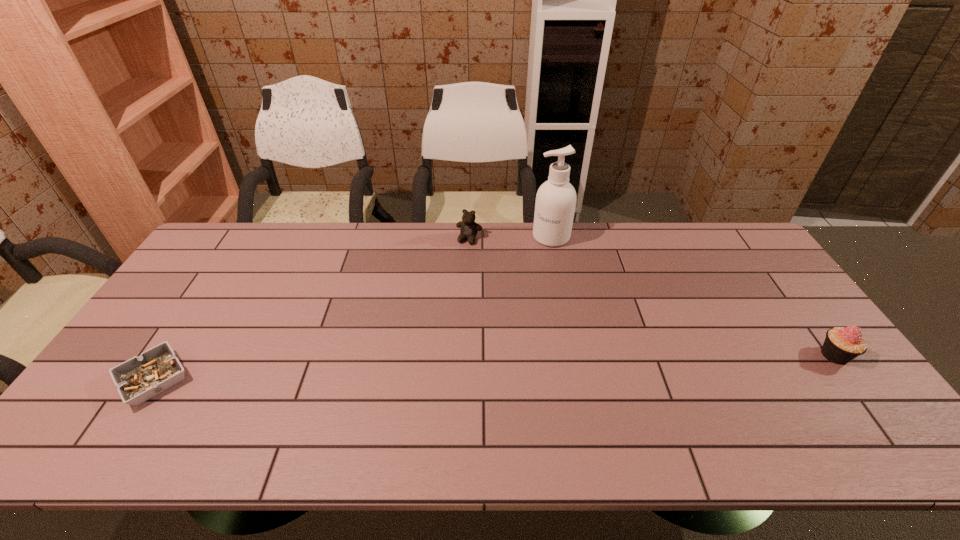
In the image, there is a desktop. Where is `vacant space at the far edge`? The image size is (960, 540). vacant space at the far edge is located at coordinates (635, 256).

Identify the location of vacant space at the near edge of the desktop. (732, 396).

Identify the location of vacant area at the left edge of the desktop. (179, 298).

Find the location of a particular element. The height and width of the screenshot is (540, 960). vacant area at the right edge of the desktop is located at coordinates (747, 272).

Image resolution: width=960 pixels, height=540 pixels. In order to click on free space at the far left corner of the desktop in this screenshot , I will do `click(218, 237)`.

Find the location of a particular element. This screenshot has width=960, height=540. free space between the third object from right to left and the second object from right to left is located at coordinates (510, 238).

You are a GUI agent. You are given a task and a screenshot of the screen. Output one action in this format:
    pyautogui.click(x=<x>, y=<y>)
    Task: Click on the vacant area that lies between the cupcake and the ashtray
    Image resolution: width=960 pixels, height=540 pixels.
    Given the screenshot: What is the action you would take?
    pyautogui.click(x=494, y=367)

This screenshot has height=540, width=960. Identify the location of blank region between the third object from left to right and the rightmost object. (693, 296).

Locate an element on the screen. The width and height of the screenshot is (960, 540). free spot between the cupcake and the third object from right to left is located at coordinates (652, 297).

Locate an element on the screen. vacant area that lies between the teddy bear and the tallest object is located at coordinates pyautogui.click(x=510, y=238).